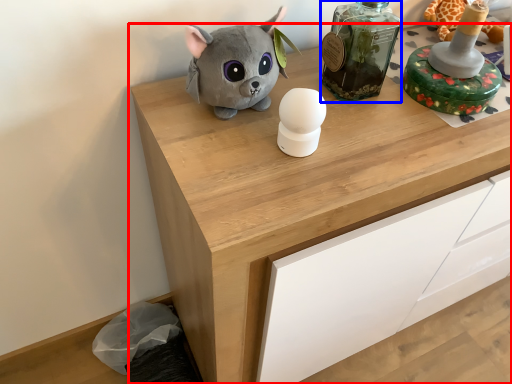
Question: Among these objects, which one is nearest to the camera, chest of drawers (highlighted by a red box) or bottle (highlighted by a blue box)?

Choices:
 (A) chest of drawers
 (B) bottle

Answer: (A)